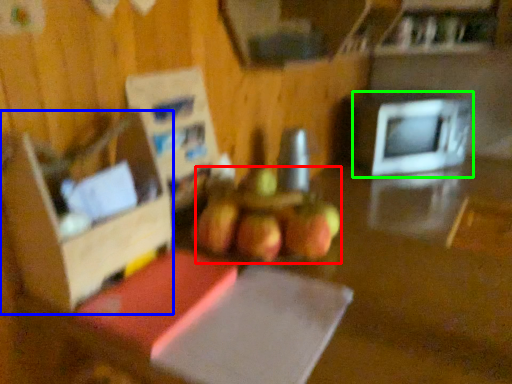
Question: Which is farther away from apple (highlighted by a red box)? box (highlighted by a blue box) or microwave oven (highlighted by a green box)?

Choices:
 (A) box
 (B) microwave oven

Answer: (B)